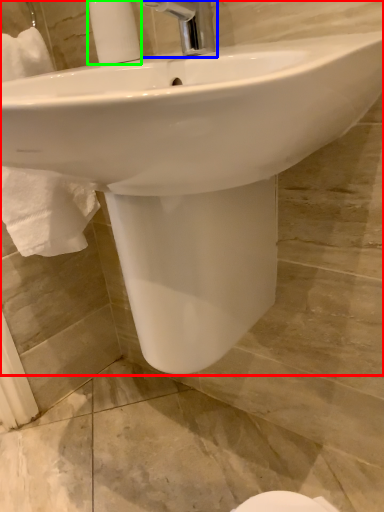
Question: Considering the real-world distances, which object is closest to sink (highlighted by a red box)? tap (highlighted by a blue box) or soap dispenser (highlighted by a green box).

Choices:
 (A) tap
 (B) soap dispenser

Answer: (A)